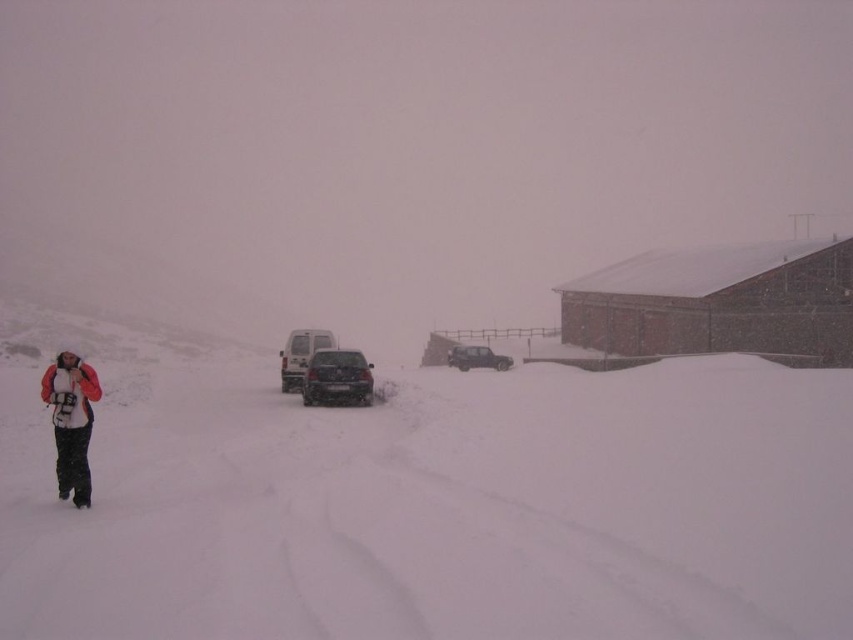
Question: Which of these objects is positioned closest to the satin black suv at center?

Choices:
 (A) dark gray matte suv at center
 (B) brick red building at right
 (C) white fluffy snow at lower left
 (D) white matte van at center

Answer: (D)

Question: Among these objects, which one is farthest from the camera?

Choices:
 (A) orange fleece jacket at left
 (B) brick red building at right

Answer: (B)

Question: Is the position of orange fleece jacket at left less distant than that of satin black suv at center?

Choices:
 (A) yes
 (B) no

Answer: (A)

Question: From the image, what is the correct spatial relationship of brick red building at right in relation to satin black suv at center?

Choices:
 (A) below
 (B) above

Answer: (B)

Question: In this image, where is brick red building at right located relative to orange fleece jacket at left?

Choices:
 (A) above
 (B) below

Answer: (A)

Question: Based on their relative distances, which object is farther from the dark gray matte suv at center?

Choices:
 (A) orange fleece jacket at left
 (B) brick red building at right
 (C) white fluffy snow at lower left
 (D) satin black suv at center

Answer: (A)